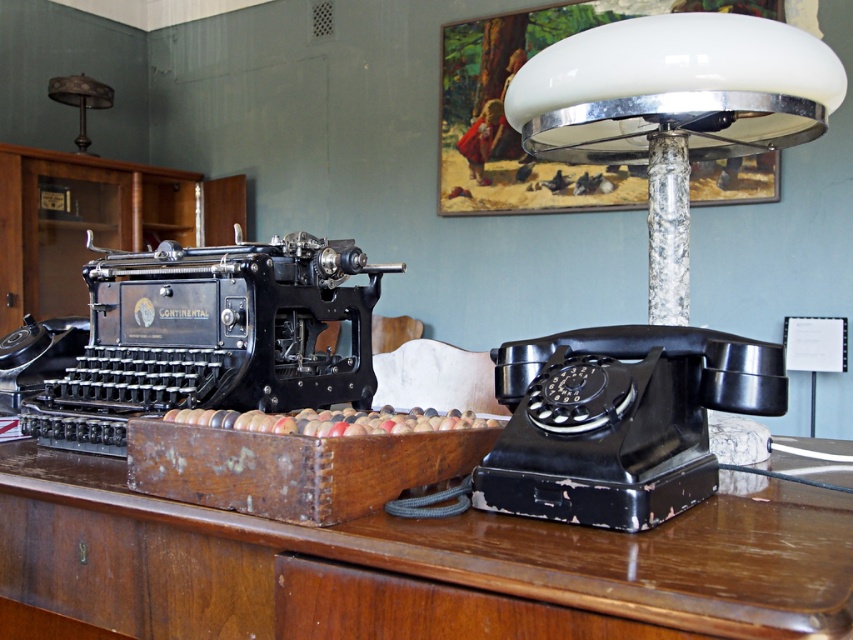
Question: Among these objects, which one is nearest to the camera?

Choices:
 (A) black metal typewriter at left
 (B) black matte rotary phone at right
 (C) brown wooden table at center
 (D) metallic lampshade at upper left

Answer: (C)

Question: Considering the real-world distances, which object is farthest from the metallic lampshade at upper left?

Choices:
 (A) white glass lampshade at upper right
 (B) black metal typewriter at left

Answer: (A)

Question: Which of the following is the closest to the observer?

Choices:
 (A) (352, 337)
 (B) (466, 563)
 (C) (593, 35)

Answer: (B)

Question: Can you confirm if brown wooden table at center is bigger than metallic lampshade at upper left?

Choices:
 (A) yes
 (B) no

Answer: (A)

Question: Considering the relative positions of black metal typewriter at left and white glass lampshade at upper right in the image provided, where is black metal typewriter at left located with respect to white glass lampshade at upper right?

Choices:
 (A) left
 (B) right

Answer: (A)

Question: Can you confirm if brown wooden table at center is positioned below metallic lampshade at upper left?

Choices:
 (A) yes
 (B) no

Answer: (A)